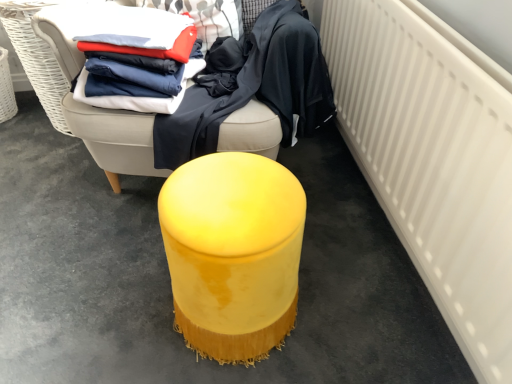
Locate an element on the screen. free location above velvet yellow ottoman at center, the second furniture when ordered from top to bottom (from a real-world perspective) is located at coordinates (222, 194).